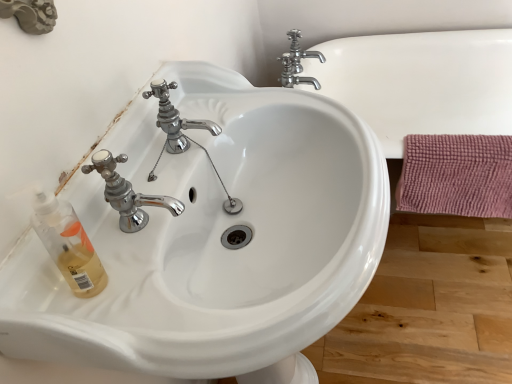
Question: Is white glossy sink at center to the left or to the right of polished chrome faucet at upper center, which is the 1th tap in front-to-back order, in the image?

Choices:
 (A) right
 (B) left

Answer: (A)

Question: From the image's perspective, is white glossy sink at center positioned above or below polished chrome faucet at upper center, marked as the 2th tap in a top-to-bottom arrangement?

Choices:
 (A) below
 (B) above

Answer: (A)

Question: Which of these objects is positioned closest to the chrome metallic faucet at upper center, the first tap from the back?

Choices:
 (A) pink textured bath towel at right
 (B) white glossy sink at center
 (C) polished chrome faucet at upper center, marked as the 2th tap in a top-to-bottom arrangement

Answer: (A)

Question: Estimate the real-world distances between objects in this image. Which object is closer to the pink textured bath towel at right?

Choices:
 (A) chrome metallic faucet at upper center, the second tap from the bottom
 (B) white glossy sink at center
 (C) polished chrome faucet at upper center, which is the 2th tap in right-to-left order

Answer: (B)